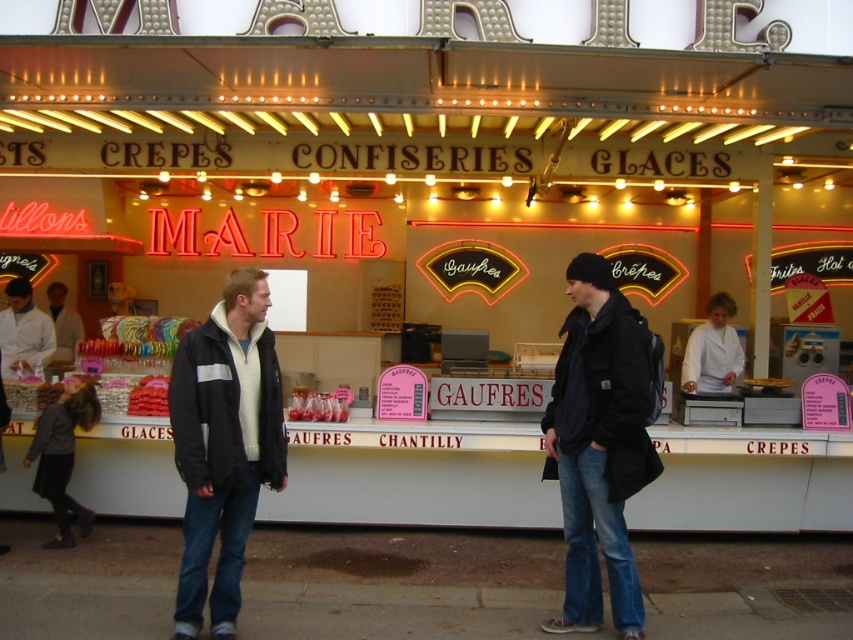
From the picture: You are a customer at the food stall and want to know which item is more likely to be a piece of clothing worn by a chef. Based on the items visible, which one is the white lab coat at left or the white cotton jacket at center?

The white lab coat at left is more likely to be the clothing worn by a chef because lab coats are typically worn in food preparation environments, whereas the white cotton jacket at center might be a casual outerwear item.